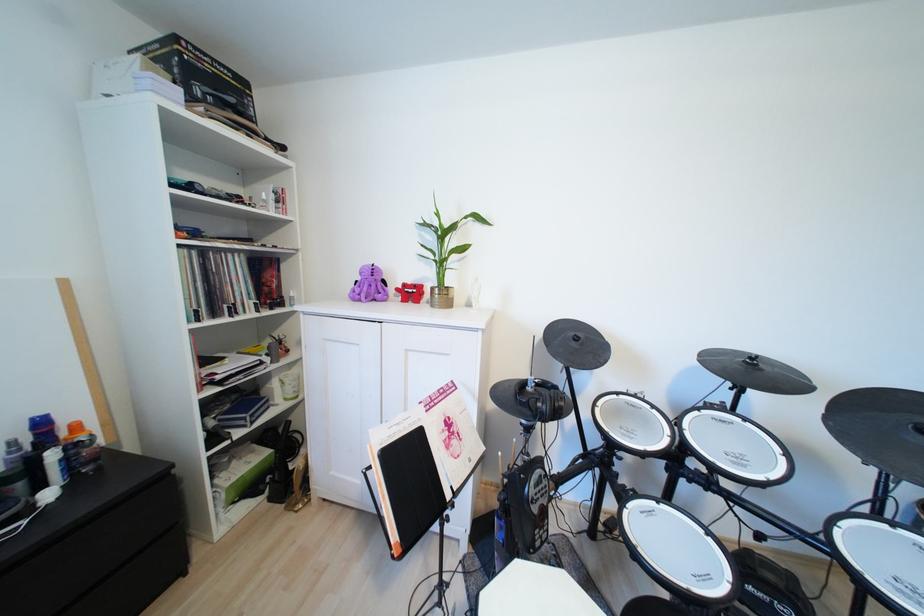
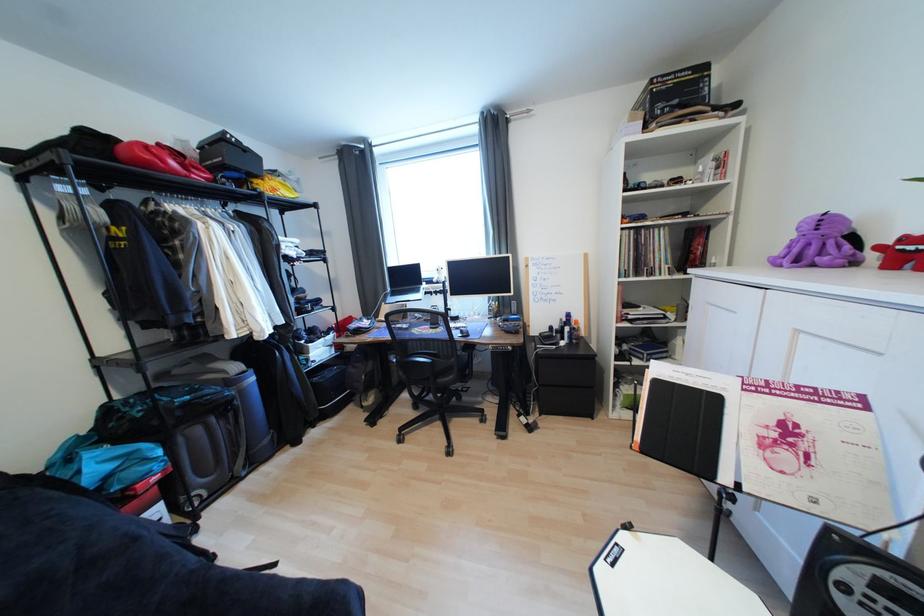
Question: The images are taken continuously from a first-person perspective. In which direction is your viewpoint rotating?

Choices:
 (A) Left
 (B) Right
 (C) Up
 (D) Down

Answer: (A)